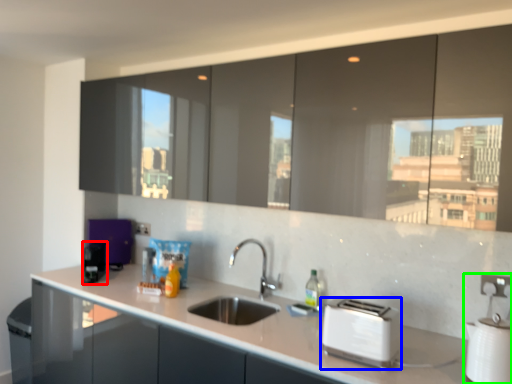
Question: Considering the real-world distances, which object is closest to appliance (highlighted by a red box)? toaster (highlighted by a blue box) or appliance (highlighted by a green box).

Choices:
 (A) toaster
 (B) appliance

Answer: (A)